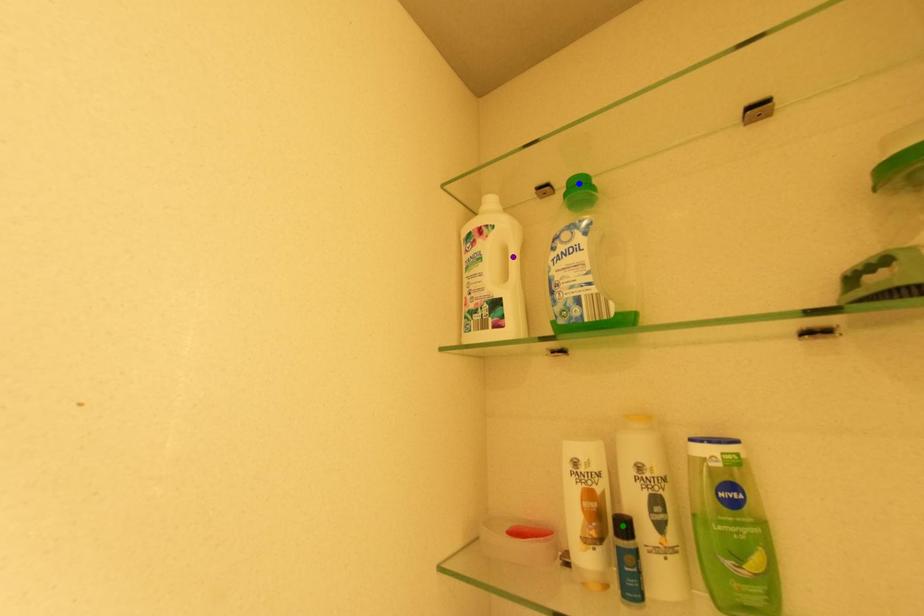
Order these from nearest to farthest:
- blue point
- green point
- purple point

green point, blue point, purple point